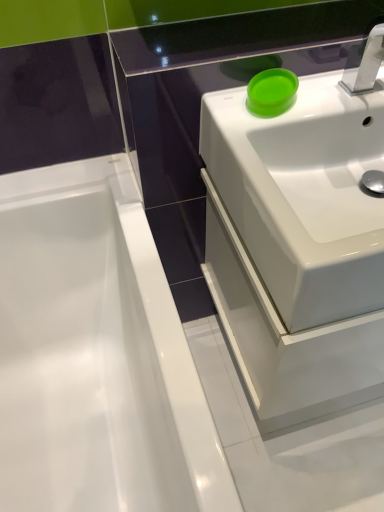
Where is `free space in front of matte green bowl at upper right`? This screenshot has width=384, height=512. free space in front of matte green bowl at upper right is located at coordinates (264, 130).